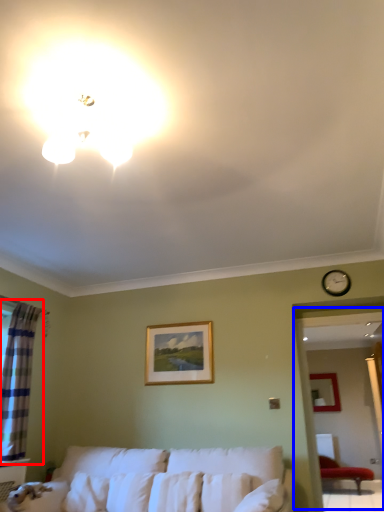
Question: Which point is closer to the camera, curtain (highlighted by a red box) or bay window (highlighted by a blue box)?

Choices:
 (A) curtain
 (B) bay window

Answer: (A)